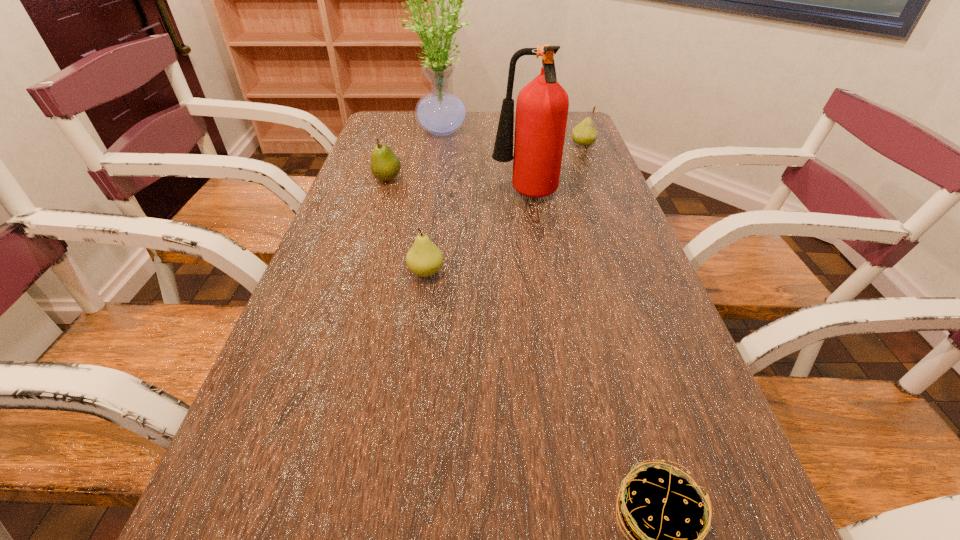
This screenshot has height=540, width=960. I want to click on the tallest object, so click(440, 112).

Identify the location of the fifth shortest object. The image size is (960, 540). (542, 105).

You are a GUI agent. You are given a task and a screenshot of the screen. Output one action in this format:
    pyautogui.click(x=<x>, y=<y>)
    Task: Click on the rightmost object
    
    Given the screenshot: What is the action you would take?
    pyautogui.click(x=584, y=134)

Identify the location of the farthest pear. (584, 134).

Find the location of a particular element. the second farthest pear is located at coordinates (385, 165).

Locate an element on the screen. Image resolution: width=960 pixels, height=540 pixels. the fifth farthest object is located at coordinates (424, 259).

The image size is (960, 540). Identify the location of the second pear from right to left. (424, 259).

Where is `free space located on the front of the flower arrangement`? This screenshot has height=540, width=960. free space located on the front of the flower arrangement is located at coordinates (437, 190).

This screenshot has height=540, width=960. What are the coordinates of `vacant space located at the nozzle of the fire extinguisher` in the screenshot? It's located at (403, 196).

The height and width of the screenshot is (540, 960). I want to click on vacant area situated 0.330m at the nozzle of the fire extinguisher, so click(371, 196).